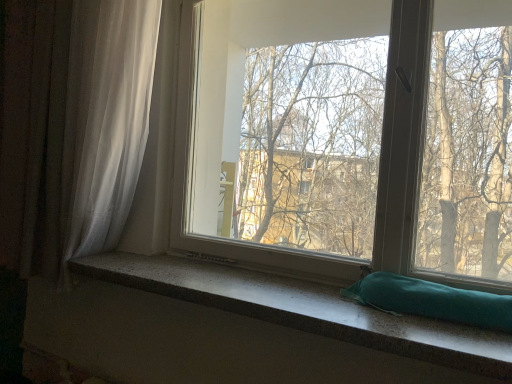
Question: Does transparent glass window at center have a larger size compared to white sheer curtain at left?

Choices:
 (A) yes
 (B) no

Answer: (B)

Question: From a real-world perspective, is transparent glass window at center physically above white sheer curtain at left?

Choices:
 (A) yes
 (B) no

Answer: (A)

Question: Does transparent glass window at center have a smaller size compared to white sheer curtain at left?

Choices:
 (A) no
 (B) yes

Answer: (B)

Question: Can we say transparent glass window at center lies outside white sheer curtain at left?

Choices:
 (A) yes
 (B) no

Answer: (A)

Question: Is transparent glass window at center looking in the opposite direction of white sheer curtain at left?

Choices:
 (A) no
 (B) yes

Answer: (A)

Question: From the image's perspective, does transparent glass window at center appear lower than white sheer curtain at left?

Choices:
 (A) yes
 (B) no

Answer: (A)

Question: From a real-world perspective, is granite-like teal pillow at lower center beneath transparent glass window at center?

Choices:
 (A) yes
 (B) no

Answer: (A)

Question: Are granite-like teal pillow at lower center and transparent glass window at center making contact?

Choices:
 (A) no
 (B) yes

Answer: (A)

Question: Is granite-like teal pillow at lower center to the right of transparent glass window at center from the viewer's perspective?

Choices:
 (A) no
 (B) yes

Answer: (A)

Question: Is there a large distance between granite-like teal pillow at lower center and transparent glass window at center?

Choices:
 (A) yes
 (B) no

Answer: (B)

Question: Is granite-like teal pillow at lower center behind transparent glass window at center?

Choices:
 (A) no
 (B) yes

Answer: (A)

Question: Is granite-like teal pillow at lower center facing away from transparent glass window at center?

Choices:
 (A) no
 (B) yes

Answer: (A)

Question: From the image's perspective, would you say teal fabric pillow at lower right is shown under granite-like teal pillow at lower center?

Choices:
 (A) no
 (B) yes

Answer: (A)